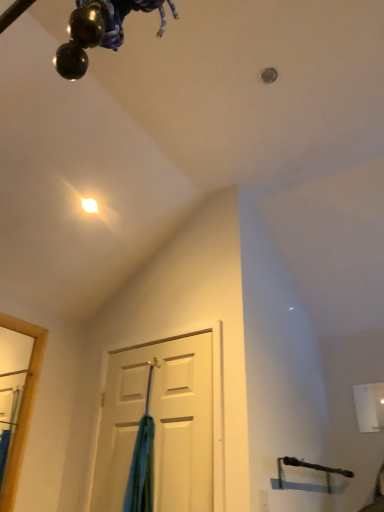
Based on the photo, what is the approximate width of blue fabric at center?

3.21 inches.

Describe the element at coordinates (142, 461) in the screenshot. The width and height of the screenshot is (384, 512). I see `blue fabric at center` at that location.

Measure the distance between blue fabric at center and camera.

The depth of blue fabric at center is 6.59 feet.

I want to click on blue fabric at center, so click(x=142, y=461).

The height and width of the screenshot is (512, 384). What do you see at coordinates (159, 423) in the screenshot?
I see `white matte door at center` at bounding box center [159, 423].

Where is `white matte door at center`? The width and height of the screenshot is (384, 512). white matte door at center is located at coordinates (159, 423).

Find the location of a particular element. blue fabric at center is located at coordinates [142, 461].

Between white matte door at center and blue fabric at center, which one appears on the left side from the viewer's perspective?

Positioned to the left is blue fabric at center.

Is white matte door at center in front of blue fabric at center?

Yes, white matte door at center is closer to the camera.

Which is closer, (x=205, y=339) or (x=136, y=444)?

Positioned in front is point (x=136, y=444).

From the image's perspective, which one is positioned higher, white matte door at center or blue fabric at center?

white matte door at center is shown above in the image.

From a real-world perspective, who is located lower, white matte door at center or blue fabric at center?

From a 3D spatial view, blue fabric at center is below.

Does white matte door at center have a greater width compared to blue fabric at center?

No.

Is white matte door at center taller than blue fabric at center?

Indeed, white matte door at center has a greater height compared to blue fabric at center.

Which of these two, white matte door at center or blue fabric at center, is bigger?

With larger size is white matte door at center.

Is white matte door at center not within blue fabric at center?

white matte door at center lies outside blue fabric at center's area.

Is white matte door at center directly adjacent to blue fabric at center?

No, white matte door at center is not beside blue fabric at center.

In the scene shown: Could you tell me if white matte door at center is facing blue fabric at center?

Yes, white matte door at center is facing blue fabric at center.

How many degrees apart are the facing directions of white matte door at center and blue fabric at center?

white matte door at center and blue fabric at center are facing 0.00132 degrees away from each other.

How distant is white matte door at center from blue fabric at center?

A distance of 6.11 inches exists between white matte door at center and blue fabric at center.

You are a GUI agent. You are given a task and a screenshot of the screen. Output one action in this format:
    pyautogui.click(x=<x>, y=<y>)
    Task: Click on the curtain behind the white matte door at center
    
    Given the screenshot: What is the action you would take?
    pyautogui.click(x=142, y=461)

Between blue fabric at center and white matte door at center, which one appears on the left side from the viewer's perspective?

blue fabric at center.

In the scene shown: Does blue fabric at center lie in front of white matte door at center?

That is False.

In the scene shown: Which is closer, (142,442) or (118,390)?

Point (142,442) is positioned closer to the camera compared to point (118,390).

From the image's perspective, between blue fabric at center and white matte door at center, which one is located above?

From the image's view, white matte door at center is above.

From a real-world perspective, who is located lower, blue fabric at center or white matte door at center?

blue fabric at center.

Can you confirm if blue fabric at center is wider than white matte door at center?

Yes, blue fabric at center is wider than white matte door at center.

Can you confirm if blue fabric at center is taller than white matte door at center?

In fact, blue fabric at center may be shorter than white matte door at center.

Who is smaller, blue fabric at center or white matte door at center?

blue fabric at center.

Is blue fabric at center completely or partially outside of white matte door at center?

Yes.

Can you see blue fabric at center touching white matte door at center?

Result: No, blue fabric at center is not making contact with white matte door at center.

Could you tell me if blue fabric at center is facing white matte door at center?

Yes, blue fabric at center is oriented towards white matte door at center.

How many degrees apart are the facing directions of blue fabric at center and white matte door at center?

They differ by 0.00132 degrees in their facing directions.

At what (x,y) coordinates should I click in order to perform the action: click on curtain on the left of white matte door at center. Please return your answer as a coordinate pair (x, y). The height and width of the screenshot is (512, 384). Looking at the image, I should click on click(142, 461).

At what (x,y) coordinates should I click in order to perform the action: click on curtain below the white matte door at center (from the image's perspective). Please return your answer as a coordinate pair (x, y). Image resolution: width=384 pixels, height=512 pixels. Looking at the image, I should click on (142, 461).

Locate an element on the screen. door above the blue fabric at center (from a real-world perspective) is located at coordinates (159, 423).